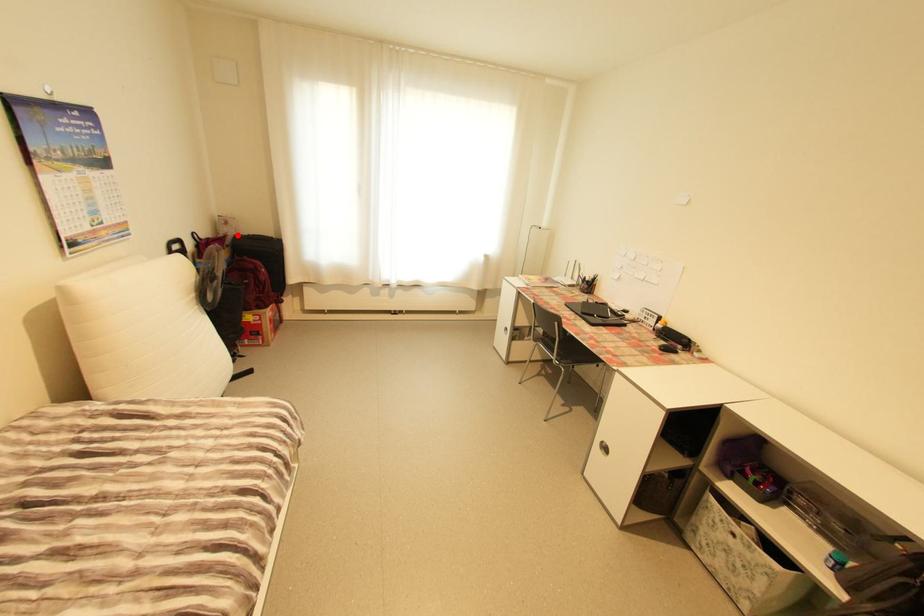
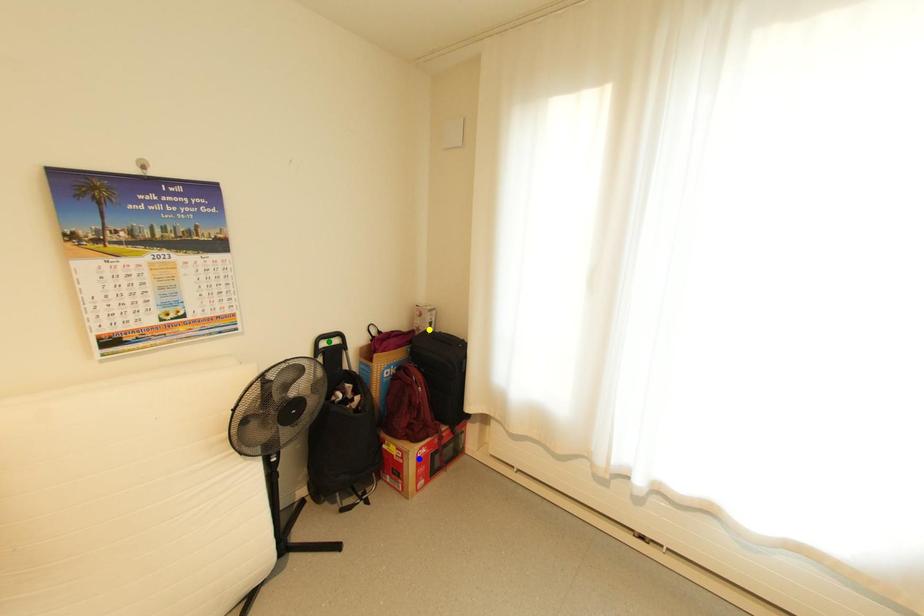
Question: I am providing you with two images of the same scene from different viewpoints. A red point is marked on the first image. You are given multiple points on the second image. In image 2, which mark is for the same physical point as the one in image 1?

Choices:
 (A) green point
 (B) blue point
 (C) yellow point

Answer: (C)